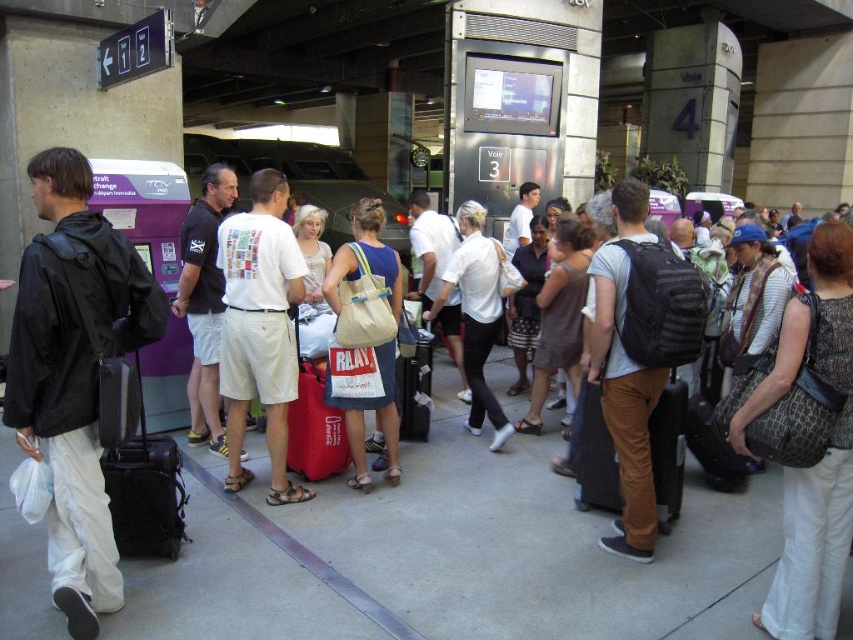
From the picture: You are a porter at the train station and need to stack the black leather suitcase at left and the matte red suitcase at center vertically. Which one should you place at the bottom to ensure stability?

The black leather suitcase at left should be placed at the bottom because it has a greater height than the matte red suitcase at center, providing a more stable base.